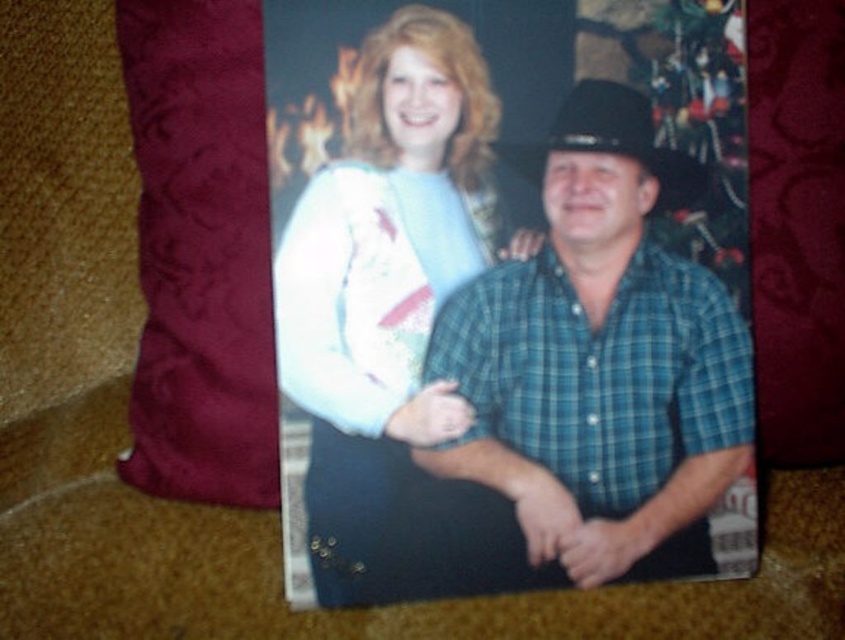
Question: Can you confirm if blue plaid shirt at center is positioned to the left of black felt cowboy hat at center?

Choices:
 (A) yes
 (B) no

Answer: (A)

Question: Which of the following is the farthest from the observer?

Choices:
 (A) blue plaid shirt at center
 (B) velvet-like burgundy throw pillow at left

Answer: (B)

Question: From the image, what is the correct spatial relationship of blue plaid shirt at center in relation to black felt cowboy hat at center?

Choices:
 (A) left
 (B) right

Answer: (A)

Question: Which point is farther to the camera?

Choices:
 (A) (189, 406)
 (B) (650, 172)

Answer: (A)

Question: Is white textured sweater at center to the left of blue plaid shirt at center from the viewer's perspective?

Choices:
 (A) yes
 (B) no

Answer: (A)

Question: Based on their relative distances, which object is nearer to the black felt cowboy hat at center?

Choices:
 (A) blue plaid shirt at center
 (B) white textured sweater at center
 (C) velvet-like burgundy throw pillow at left

Answer: (A)